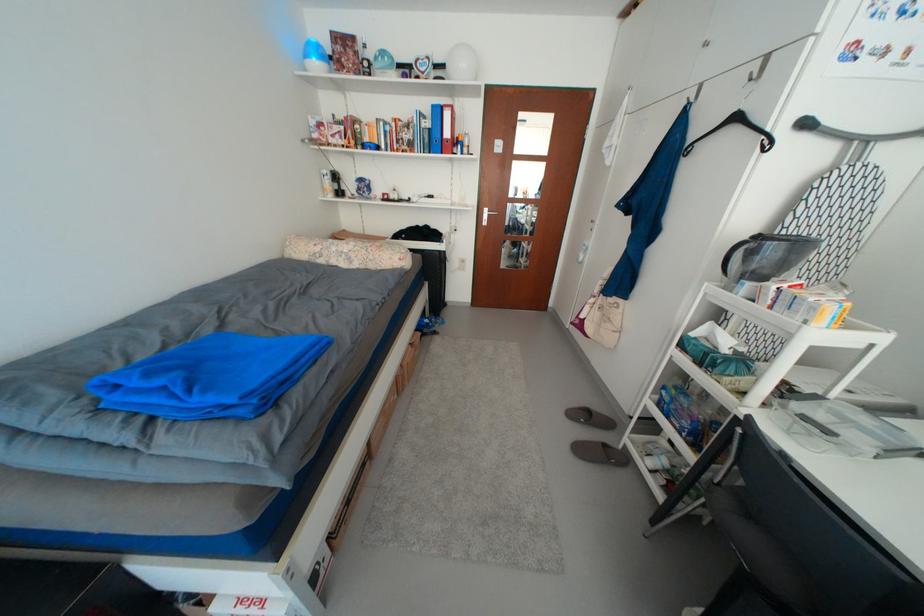
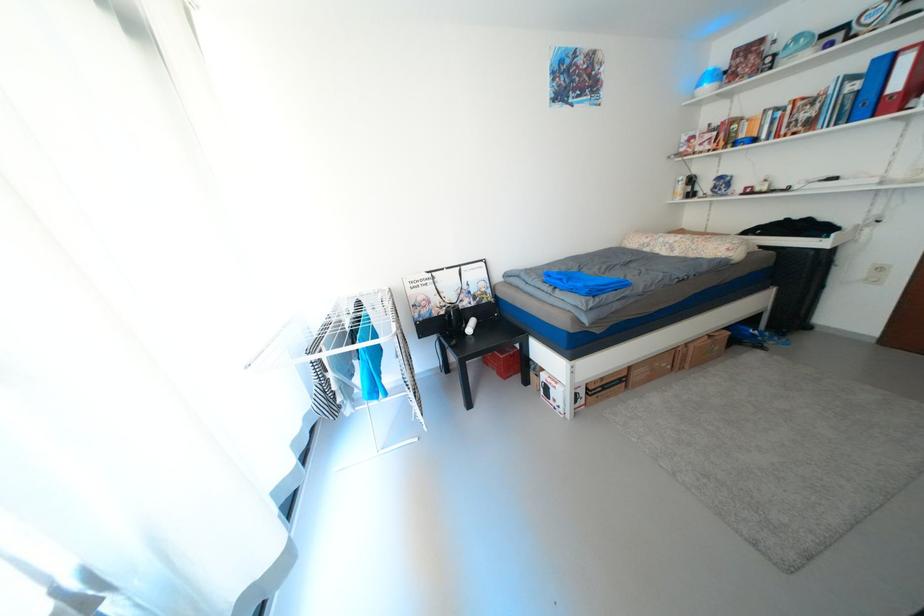
Question: The first image is from the beginning of the video and the second image is from the end. How did the camera likely rotate when shooting the video?

Choices:
 (A) Left
 (B) Right
 (C) Up
 (D) Down

Answer: (A)